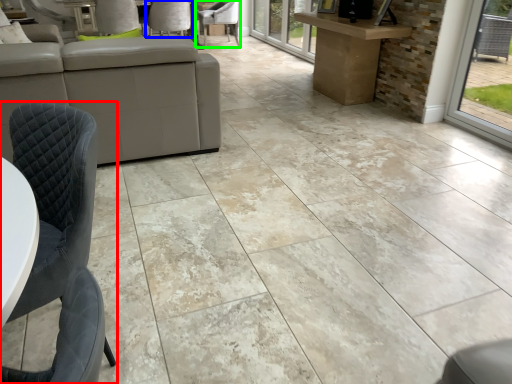
Question: Considering the real-world distances, which object is farthest from chair (highlighted by a red box)? chair (highlighted by a blue box) or chair (highlighted by a green box)?

Choices:
 (A) chair
 (B) chair

Answer: (B)